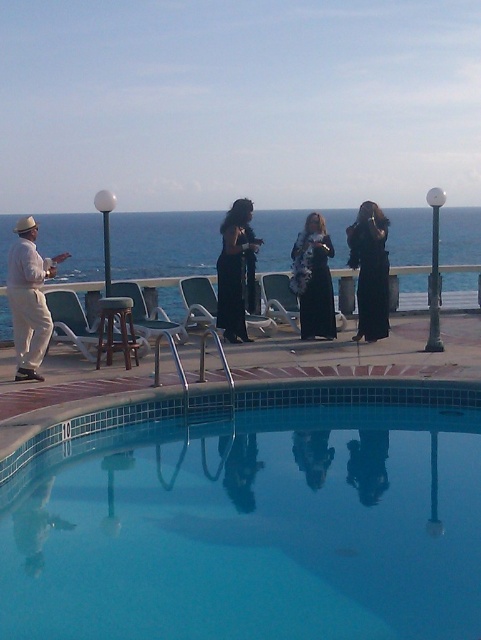
Consider the image. You are standing at the edge of the curved swimming pool with blue tiles and want to reach both points mentioned. Which point, point (24,264) or point (291,308), is closer to you?

Point (24,264) is closer to the viewer than point (291,308).

You are standing at the edge of the transparent glass pool at center and want to reach the man to your left. The pool is 6.10 meters long from where you are standing. If you walk straight towards the man, will you step into the pool?

The transparent glass pool at center is 6.10 meters from the viewer. If you walk straight towards the man, you will step into the pool since the distance matches the pool length.